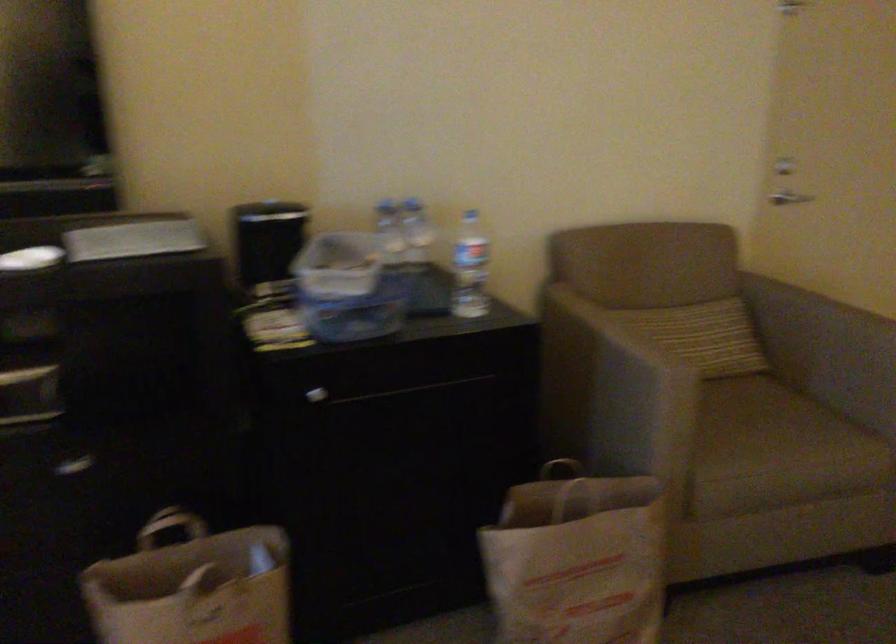
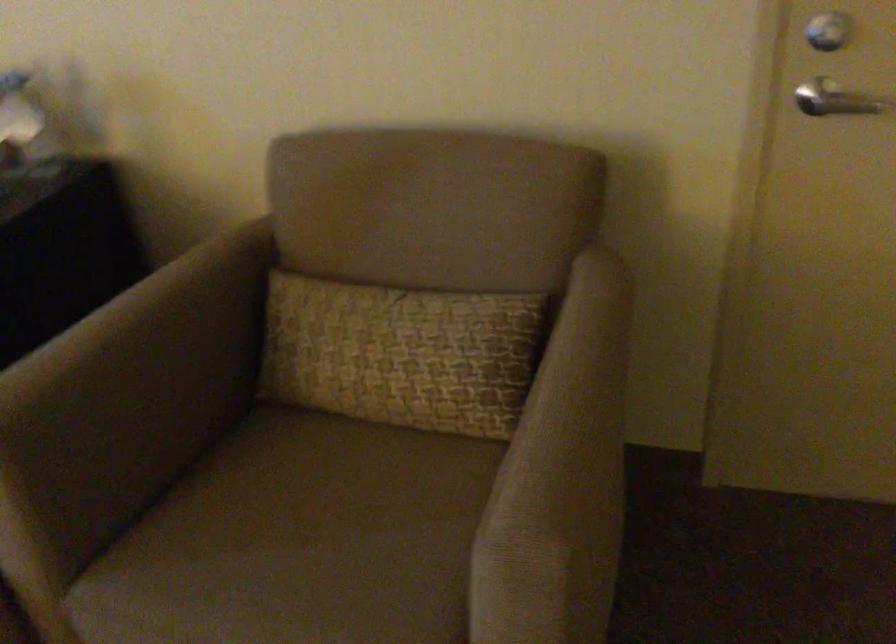
In the second image, find the point that corresponds to point (810, 187) in the first image.

(840, 102)